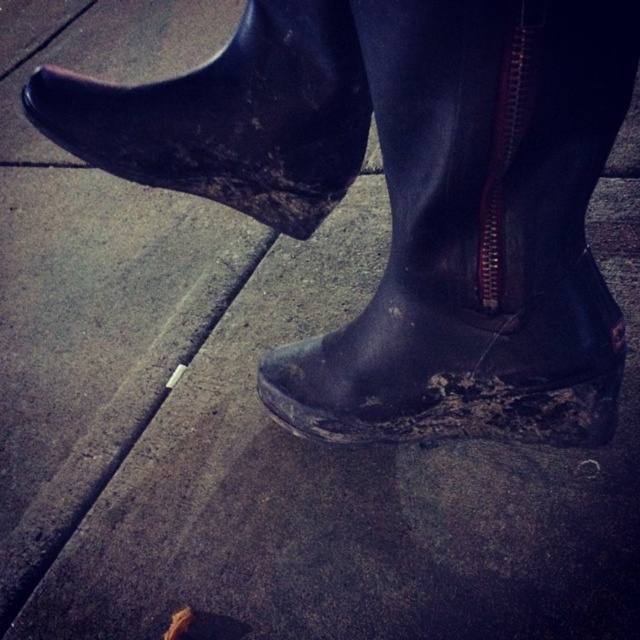
How far apart are muddy rubber boot at center and gray concrete curb at lower left?

muddy rubber boot at center is 18.36 inches away from gray concrete curb at lower left.

Image resolution: width=640 pixels, height=640 pixels. What do you see at coordinates (460, 360) in the screenshot?
I see `muddy rubber boot at center` at bounding box center [460, 360].

Where is `muddy rubber boot at center`? The width and height of the screenshot is (640, 640). muddy rubber boot at center is located at coordinates (460, 360).

You are a GUI agent. You are given a task and a screenshot of the screen. Output one action in this format:
    pyautogui.click(x=<x>, y=<y>)
    Task: Click on the muddy rubber boot at center
    The width and height of the screenshot is (640, 640).
    Given the screenshot: What is the action you would take?
    pyautogui.click(x=460, y=360)

Is point (490, 292) positioned behind point (353, 170)?

No, (490, 292) is in front of (353, 170).

Is muddy rubber boot at center in front of muddy rubber boot at upper left?

That is False.

What do you see at coordinates (460, 360) in the screenshot?
I see `muddy rubber boot at center` at bounding box center [460, 360].

I want to click on muddy rubber boot at center, so coord(460,360).

Can you confirm if muddy rubber boot at upper left is thinner than gray concrete curb at lower left?

No.

Which is above, muddy rubber boot at upper left or gray concrete curb at lower left?

Positioned higher is muddy rubber boot at upper left.

The image size is (640, 640). Describe the element at coordinates (230, 116) in the screenshot. I see `muddy rubber boot at upper left` at that location.

Image resolution: width=640 pixels, height=640 pixels. Find the location of `muddy rubber boot at upper left`. muddy rubber boot at upper left is located at coordinates (230, 116).